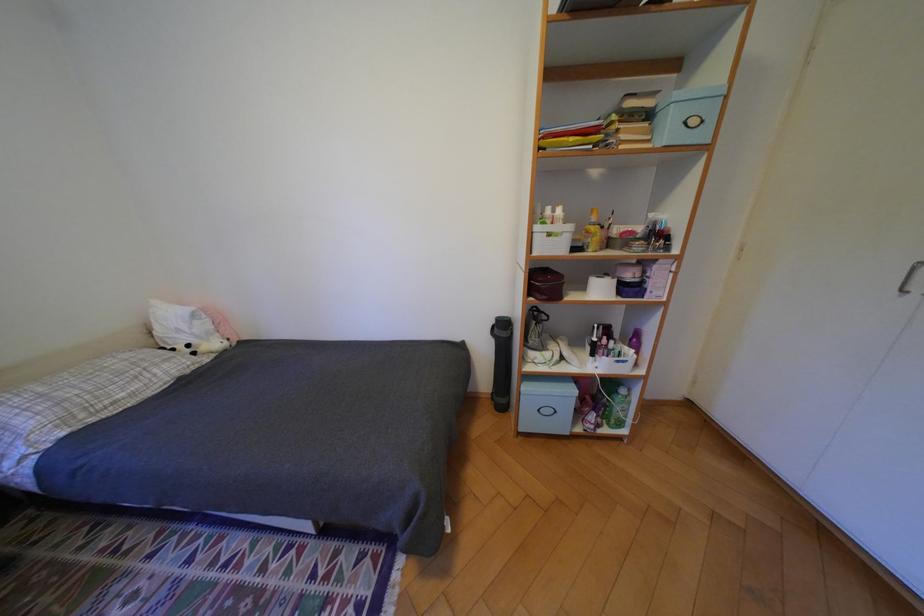
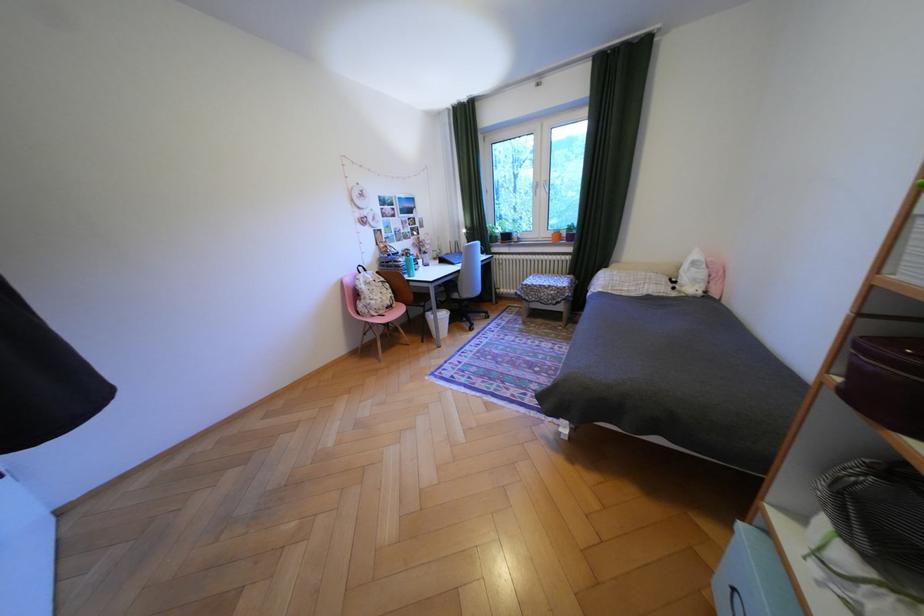
Where in the second image is the point corresponding to pixel 201 346 from the first image?

(687, 282)